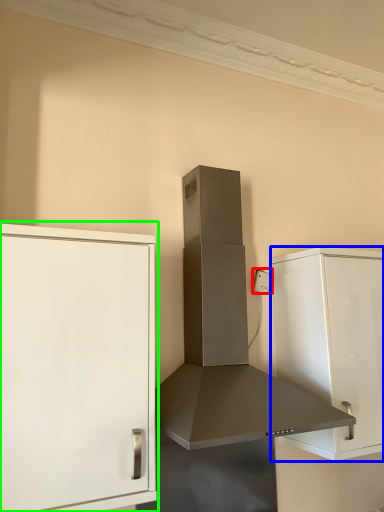
Question: Which object is the closest to the electric outlet (highlighted by a red box)? Choose among these: cabinetry (highlighted by a blue box) or cabinetry (highlighted by a green box).

Choices:
 (A) cabinetry
 (B) cabinetry

Answer: (A)